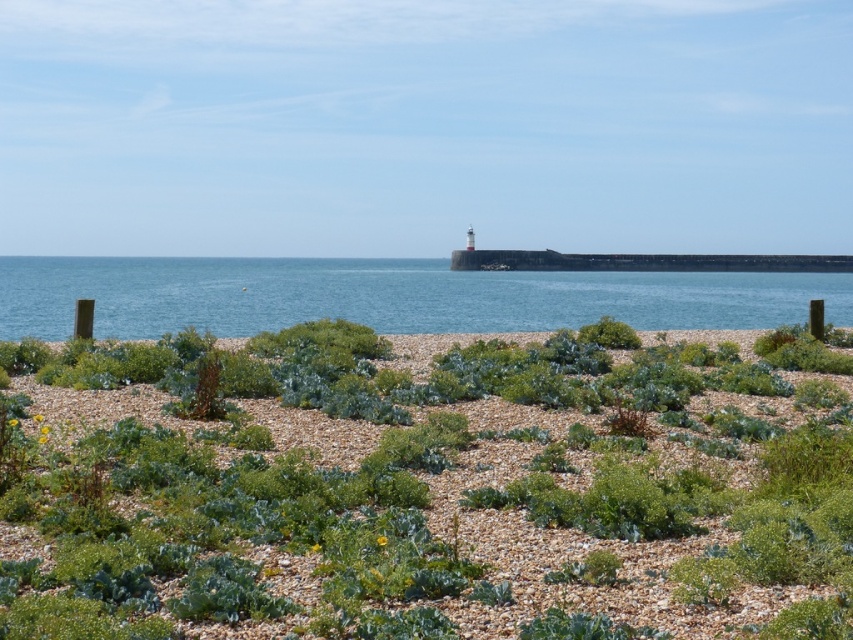
Which of these two, green leafy plant at center or blue water at center, stands taller?

blue water at center is taller.

Does green leafy plant at center appear on the right side of blue water at center?

Incorrect, green leafy plant at center is not on the right side of blue water at center.

Which is in front, point (170, 445) or point (364, 304)?

Positioned in front is point (170, 445).

Locate an element on the screen. green leafy plant at center is located at coordinates (419, 492).